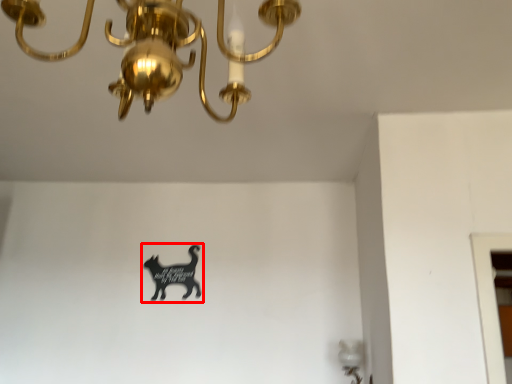
Question: From the image's perspective, what is the correct spatial relationship of animal (annotated by the red box) in relation to lamp?

Choices:
 (A) below
 (B) above

Answer: (A)